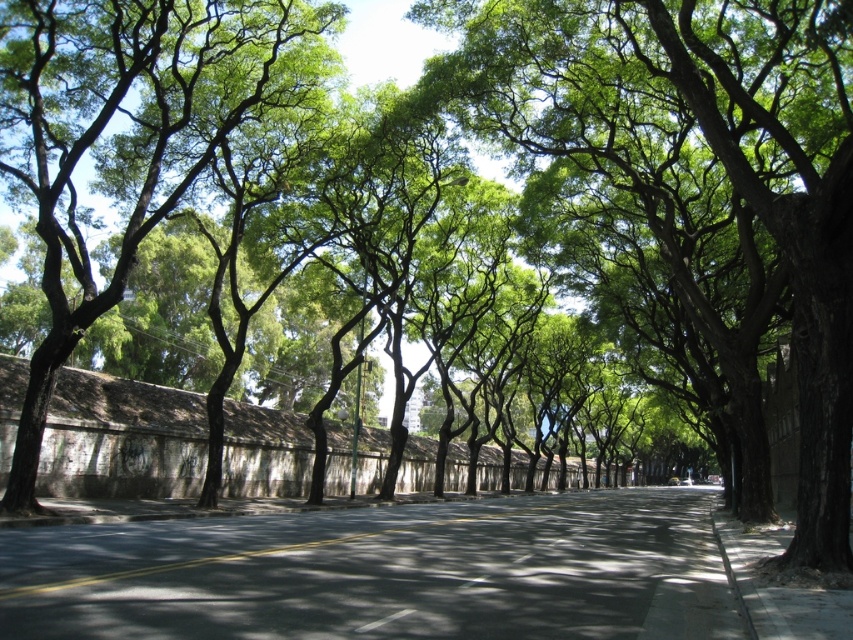
Between dark gray asphalt at center and white glossy line at center, which one is positioned lower?

dark gray asphalt at center is lower down.

Does dark gray asphalt at center have a greater width compared to white glossy line at center?

Yes.

Is point (0, 637) positioned in front of point (405, 612)?

That is True.

The width and height of the screenshot is (853, 640). Identify the location of dark gray asphalt at center. (384, 572).